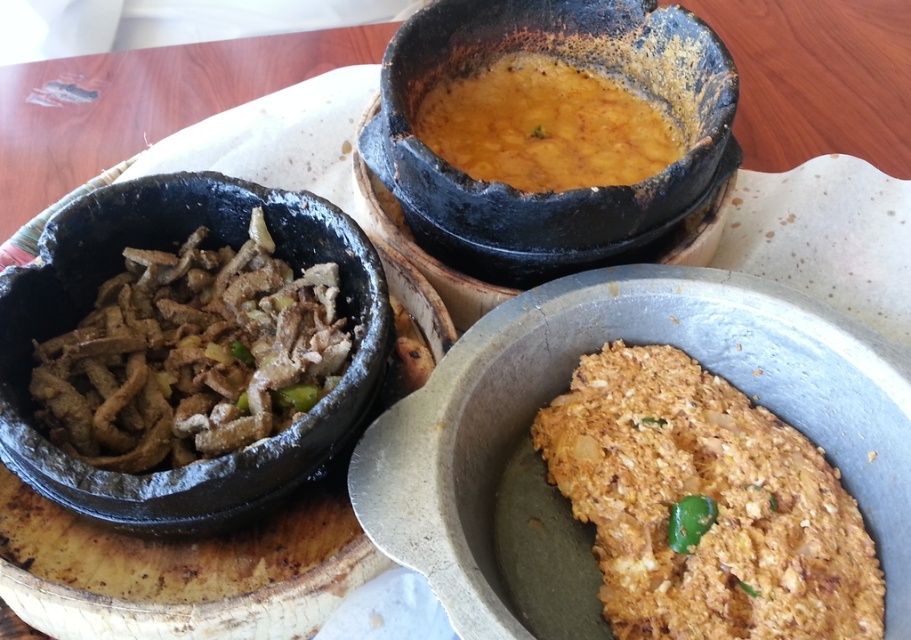
Question: Which point is closer to the camera taking this photo?

Choices:
 (A) (172, 256)
 (B) (738, 413)
 (C) (528, 61)

Answer: (B)

Question: Considering the real-world distances, which object is closest to the golden crispy fried chicken at center?

Choices:
 (A) yellow-orange paste at center
 (B) brown matte meat at left

Answer: (A)

Question: Is golden crispy fried chicken at center below brown matte meat at left?

Choices:
 (A) yes
 (B) no

Answer: (A)

Question: Does golden crispy fried chicken at center have a smaller size compared to yellow-orange paste at center?

Choices:
 (A) no
 (B) yes

Answer: (A)

Question: Based on their relative distances, which object is farther from the brown matte meat at left?

Choices:
 (A) yellow-orange paste at center
 (B) golden crispy fried chicken at center

Answer: (B)

Question: Can you confirm if brown matte meat at left is positioned above yellow-orange paste at center?

Choices:
 (A) no
 (B) yes

Answer: (A)